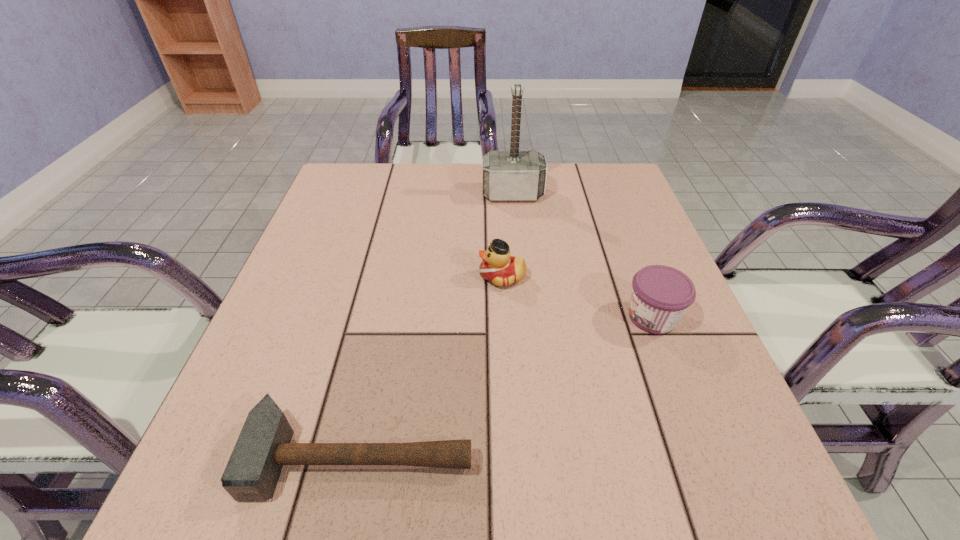
You are a GUI agent. You are given a task and a screenshot of the screen. Output one action in this format:
    pyautogui.click(x=<x>, y=<y>)
    Task: Click on the vacant space that is in between the taller hammer and the third nearest object
    This screenshot has height=540, width=960.
    Given the screenshot: What is the action you would take?
    pyautogui.click(x=508, y=235)

Locate an element on the screen. free space between the farthest object and the shortest object is located at coordinates (437, 325).

Image resolution: width=960 pixels, height=540 pixels. What are the coordinates of `free space that is in between the jam and the duck` in the screenshot? It's located at (577, 297).

The width and height of the screenshot is (960, 540). I want to click on vacant space that's between the rightmost object and the duck, so click(x=577, y=297).

This screenshot has height=540, width=960. In order to click on vacant point located between the taller hammer and the second farthest object in this screenshot , I will do `click(508, 235)`.

Identify the location of object that is the second closest to the farther hammer. (660, 296).

Identify which object is located as the second nearest to the jam. Please provide its 2D coordinates. Your answer should be formatted as a tuple, i.e. [(x, y)], where the tuple contains the x and y coordinates of a point satisfying the conditions above.

[(264, 445)]

Image resolution: width=960 pixels, height=540 pixels. I want to click on free region that satisfies the following two spatial constraints: 1. on the front label of the rightmost object; 2. on the striking surface of the left hammer, so click(705, 455).

Identify the location of free space that satisfies the following two spatial constraints: 1. on the front label of the third farthest object; 2. on the striking surface of the nearer hammer. The height and width of the screenshot is (540, 960). (705, 455).

Where is `free space that satisfies the following two spatial constraints: 1. for striking with the head of the tallest object; 2. on the face of the duck`? This screenshot has width=960, height=540. free space that satisfies the following two spatial constraints: 1. for striking with the head of the tallest object; 2. on the face of the duck is located at coordinates (521, 276).